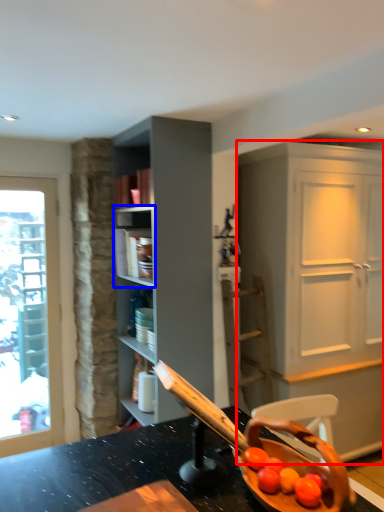
Question: Which of the following is the farthest to the observer, cabinetry (highlighted by a red box) or shelf (highlighted by a blue box)?

Choices:
 (A) cabinetry
 (B) shelf

Answer: (B)